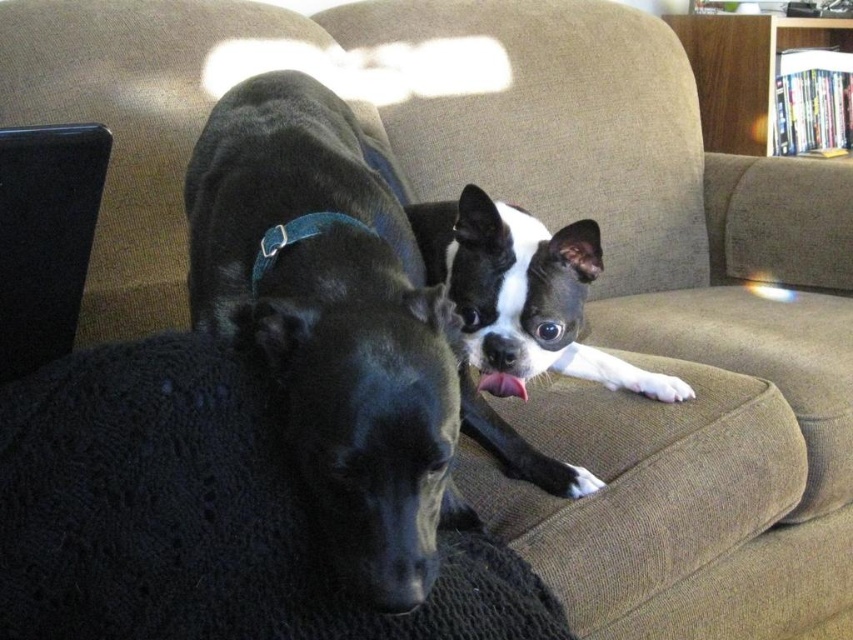
You are a dog trainer observing the two dogs on the beige couch. You notice the black matte dog at center and the blue fabric neckband at center. Which object is closer to you?

The black matte dog at center and blue fabric neckband at center are 6.51 inches apart, so it is impossible to determine which is closer without additional information about their positions relative to the observer.

You are a photographer trying to capture a closeup of the black matte dog at center and the wooden bookshelf at upper right. Since you can only focus on one subject at a time, which one should you choose to ensure the other remains in the background?

You should focus on the black matte dog at center because it is closer to the viewer than the wooden bookshelf at upper right, so the bookshelf will naturally be in the background when the dog is in focus.

From the picture: You are standing in the room where the two dogs are on the beige couch. You want to locate the wooden bookshelf at upper right. According to the coordinates provided, where should you look?

The wooden bookshelf at upper right is located at point (746, 70), so look towards the upper right corner of the room near the coordinates mentioned.